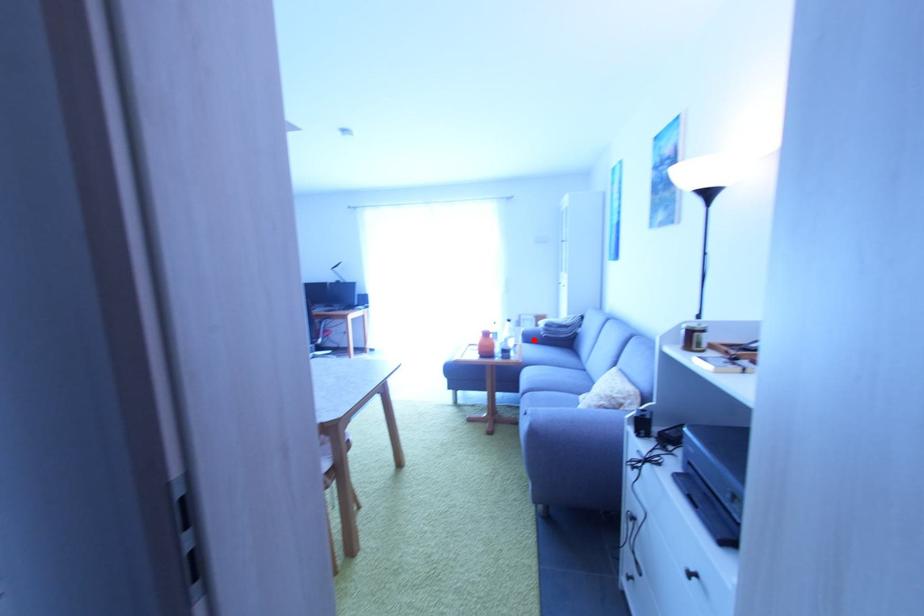
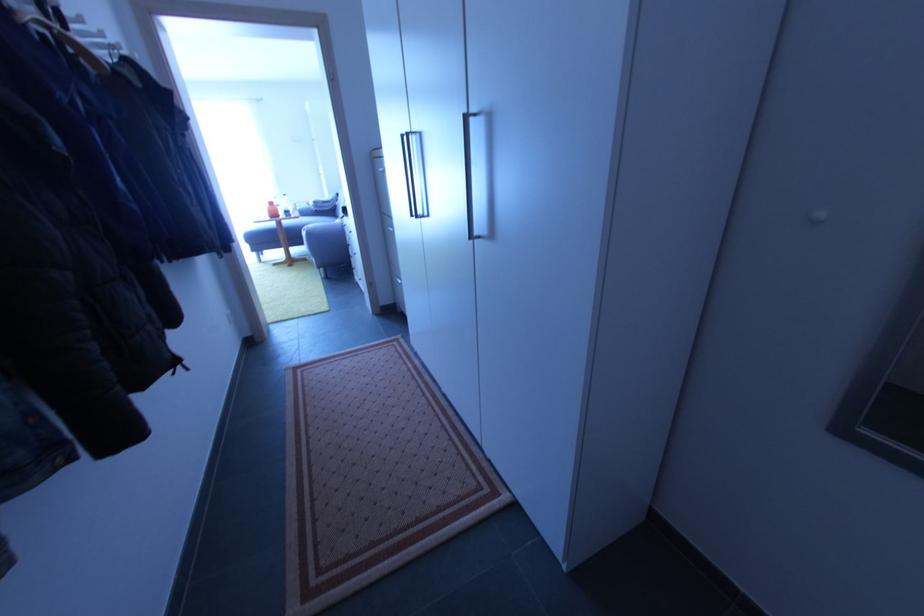
Question: I am providing you with two images of the same scene from different viewpoints. Image1 has a red point marked. In image2, the corresponding 3D location appears at what relative position? Reply with the corresponding letter.

Choices:
 (A) Closer
 (B) Farther

Answer: (A)